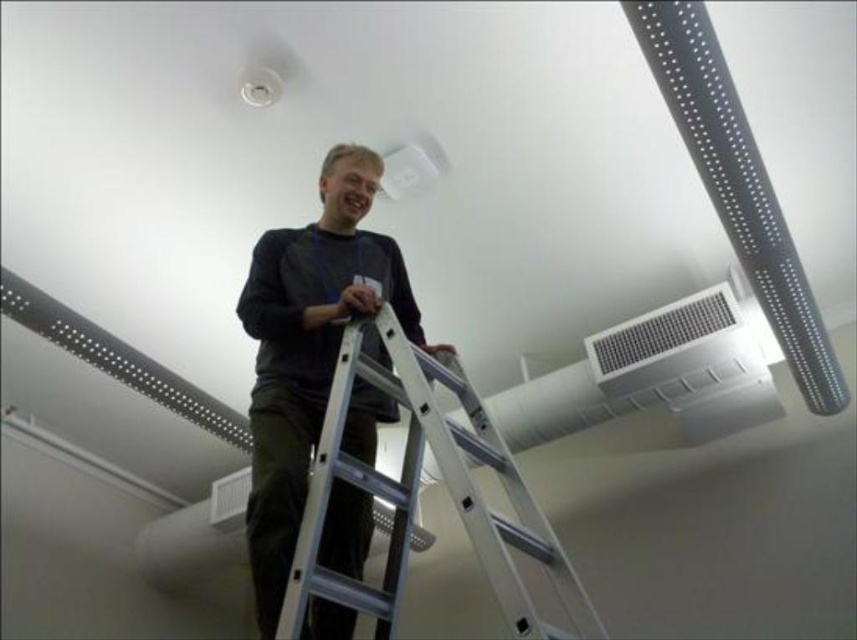
Question: Which point is farther to the camera?

Choices:
 (A) silver metallic ladder at center
 (B) dark gray matte shirt at center

Answer: (B)

Question: Which of the following is the closest to the observer?

Choices:
 (A) silver metallic ladder at center
 (B) metallic silver air conditioning at upper center

Answer: (A)

Question: Is dark gray matte shirt at center above metallic silver air conditioning at upper center?

Choices:
 (A) no
 (B) yes

Answer: (A)

Question: Which point is closer to the camera taking this photo?

Choices:
 (A) (381, 483)
 (B) (700, 308)
 (C) (376, 388)

Answer: (A)

Question: From the image, what is the correct spatial relationship of silver metallic ladder at center in relation to metallic silver air conditioning at upper center?

Choices:
 (A) right
 (B) left

Answer: (B)

Question: Can you confirm if silver metallic ladder at center is positioned to the right of metallic silver air conditioning at upper center?

Choices:
 (A) no
 (B) yes

Answer: (A)